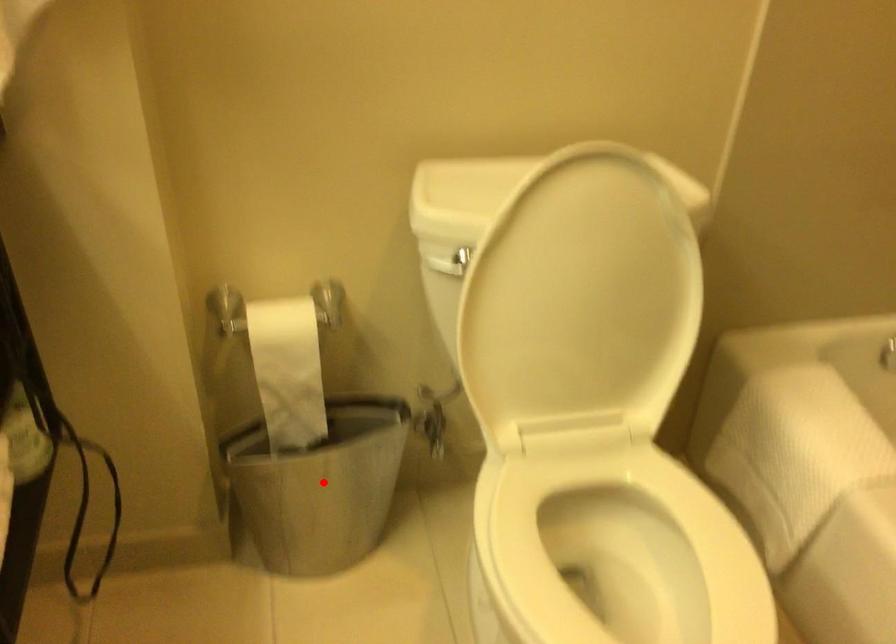
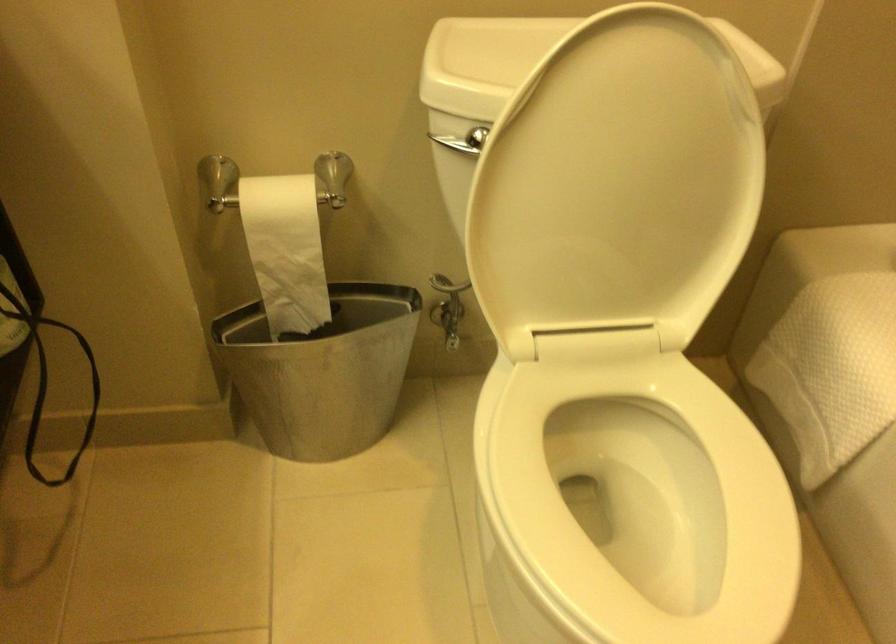
Find the pixel in the second image that matches the highlighted location in the first image.

(323, 371)